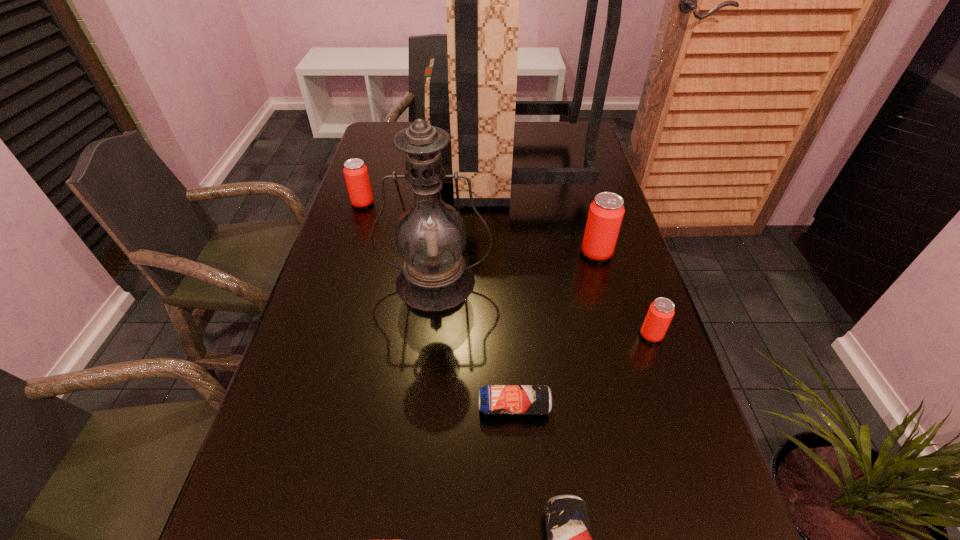
Identify which object is the sixth closest to the second nearest object. Please provide its 2D coordinates. Your answer should be formatted as a tuple, i.e. [(x, y)], where the tuple contains the x and y coordinates of a point satisfying the conditions above.

[(355, 171)]

This screenshot has width=960, height=540. In order to click on the closest object to the oil lamp in this screenshot , I will do `click(355, 171)`.

At what (x,y) coordinates should I click in order to perform the action: click on beer can that is the second nearest to the nearest object. Please return your answer as a coordinate pair (x, y). The width and height of the screenshot is (960, 540). Looking at the image, I should click on (660, 313).

Identify which beer can is the second nearest to the third shortest object. Please provide its 2D coordinates. Your answer should be formatted as a tuple, i.e. [(x, y)], where the tuple contains the x and y coordinates of a point satisfying the conditions above.

[(493, 399)]

The height and width of the screenshot is (540, 960). Find the location of `red beer can that is the second nearest to the rightmost object`. red beer can that is the second nearest to the rightmost object is located at coordinates (355, 171).

What are the coordinates of `red beer can that stands as the second closest to the second nearest beer can` in the screenshot? It's located at (606, 212).

Find the location of `free space that satisfies the following two spatial constraints: 1. on the front side of the third shortest beer can; 2. on the left side of the fourth beer can from left to right`. free space that satisfies the following two spatial constraints: 1. on the front side of the third shortest beer can; 2. on the left side of the fourth beer can from left to right is located at coordinates (619, 335).

Where is `free location that satisfies the following two spatial constraints: 1. on the back side of the fifth shortest object; 2. on the left side of the sixth shortest object`? free location that satisfies the following two spatial constraints: 1. on the back side of the fifth shortest object; 2. on the left side of the sixth shortest object is located at coordinates (439, 253).